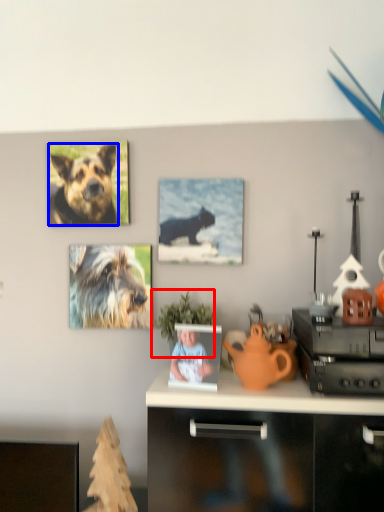
Question: Among these objects, which one is farthest to the camera, houseplant (highlighted by a red box) or dog (highlighted by a blue box)?

Choices:
 (A) houseplant
 (B) dog

Answer: (B)